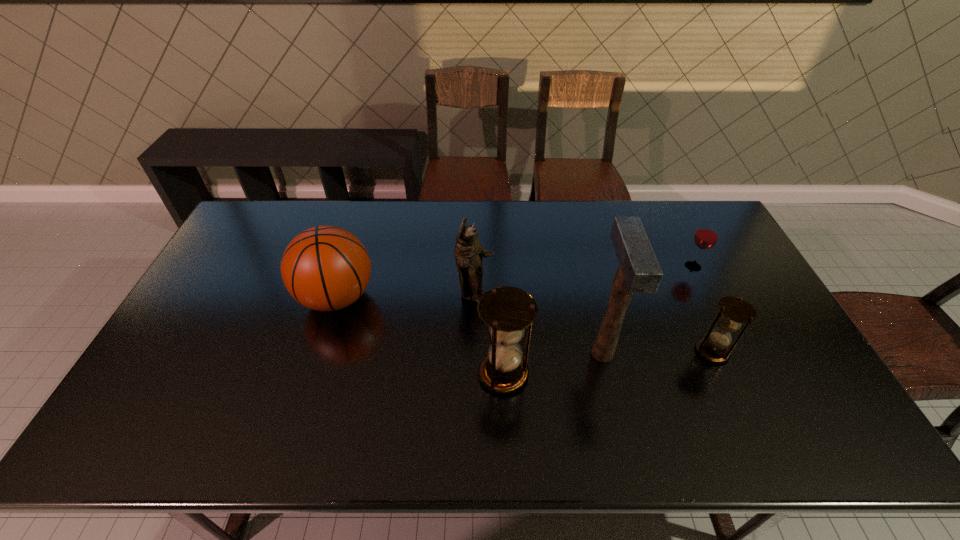
Locate an element on the screen. Image resolution: width=960 pixels, height=540 pixels. vacant space at the far right corner of the desktop is located at coordinates (689, 204).

In order to click on free space at the near right corner of the desktop in this screenshot , I will do `click(763, 388)`.

Locate an element on the screen. This screenshot has width=960, height=540. vacant space in between the taller hourglass and the tallest object is located at coordinates coord(553,363).

I want to click on free space between the mallet and the taller hourglass, so click(x=553, y=363).

Find the location of a particular element. The width and height of the screenshot is (960, 540). free space between the figurine and the mallet is located at coordinates (539, 324).

Find the location of `empty space between the right hourglass and the fourth object from left to right`. empty space between the right hourglass and the fourth object from left to right is located at coordinates (658, 352).

Where is `vacant region between the right hourglass and the figurine`? vacant region between the right hourglass and the figurine is located at coordinates (593, 323).

This screenshot has width=960, height=540. I want to click on free space between the figurine and the tallest object, so click(539, 324).

Image resolution: width=960 pixels, height=540 pixels. In order to click on unoccupied area between the right hourglass and the mallet in this screenshot , I will do point(658,352).

Where is `blank region between the figurine and the basketball`? blank region between the figurine and the basketball is located at coordinates (406, 296).